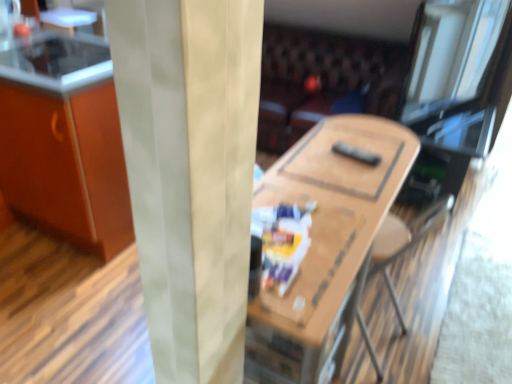
Question: Is leather couch at center beside orange matte cabinet at left?

Choices:
 (A) yes
 (B) no

Answer: (B)

Question: Is the depth of leather couch at center less than that of orange matte cabinet at left?

Choices:
 (A) no
 (B) yes

Answer: (A)

Question: From a real-world perspective, is leather couch at center below orange matte cabinet at left?

Choices:
 (A) yes
 (B) no

Answer: (A)

Question: Would you say leather couch at center is outside orange matte cabinet at left?

Choices:
 (A) yes
 (B) no

Answer: (A)

Question: Is leather couch at center smaller than orange matte cabinet at left?

Choices:
 (A) yes
 (B) no

Answer: (B)

Question: From a real-world perspective, is orange matte cabinet at left positioned above or below wooden table at center?

Choices:
 (A) above
 (B) below

Answer: (A)

Question: Based on their sizes in the image, would you say orange matte cabinet at left is bigger or smaller than wooden table at center?

Choices:
 (A) big
 (B) small

Answer: (A)

Question: From the image's perspective, is orange matte cabinet at left above or below wooden table at center?

Choices:
 (A) below
 (B) above

Answer: (B)

Question: In terms of width, does orange matte cabinet at left look wider or thinner when compared to wooden table at center?

Choices:
 (A) wide
 (B) thin

Answer: (A)

Question: From the image's perspective, is smooth glass counter top at upper left positioned above or below orange matte cabinet at left?

Choices:
 (A) above
 (B) below

Answer: (A)

Question: Considering the positions of smooth glass counter top at upper left and orange matte cabinet at left in the image, is smooth glass counter top at upper left taller or shorter than orange matte cabinet at left?

Choices:
 (A) tall
 (B) short

Answer: (B)

Question: Would you say smooth glass counter top at upper left is inside or outside orange matte cabinet at left?

Choices:
 (A) outside
 (B) inside

Answer: (B)

Question: In the image, is smooth glass counter top at upper left on the left side or the right side of orange matte cabinet at left?

Choices:
 (A) right
 (B) left

Answer: (A)

Question: Visually, is leather couch at center positioned to the left or to the right of smooth glass counter top at upper left?

Choices:
 (A) right
 (B) left

Answer: (A)

Question: Relative to smooth glass counter top at upper left, is leather couch at center in front or behind?

Choices:
 (A) front
 (B) behind

Answer: (B)